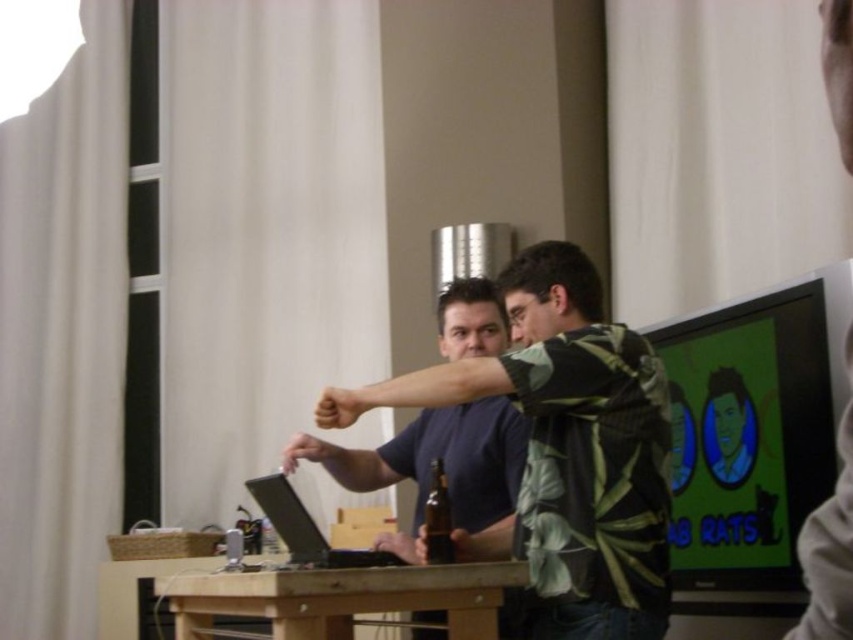
Is wooden table at center bigger than brown glass beer bottle at center?

Yes.

Image resolution: width=853 pixels, height=640 pixels. Identify the location of wooden table at center. (343, 596).

How much distance is there between green leafy shirt at center and wooden table at center?

A: green leafy shirt at center is 33.44 centimeters away from wooden table at center.

Can you confirm if green leafy shirt at center is taller than wooden table at center?

Indeed, green leafy shirt at center has a greater height compared to wooden table at center.

Who is more distant from viewer, (560,301) or (428,577)?

Point (560,301)

The width and height of the screenshot is (853, 640). I want to click on green leafy shirt at center, so click(x=567, y=445).

Between green leafy shirt at center and matte black laptop at center, which one is positioned higher?

green leafy shirt at center is above.

Which is in front, point (543, 456) or point (294, 547)?

Positioned in front is point (543, 456).

The width and height of the screenshot is (853, 640). I want to click on green leafy shirt at center, so click(567, 445).